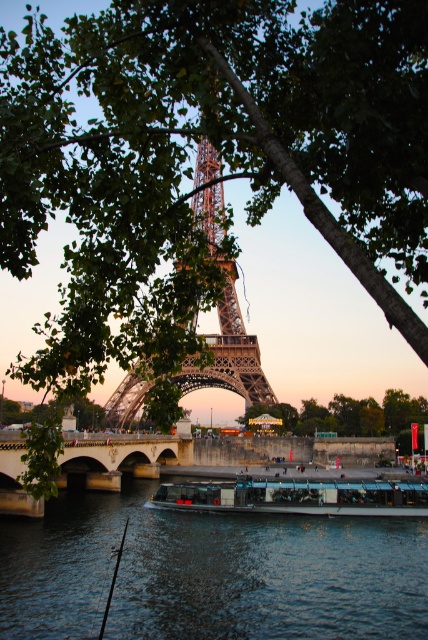
You are standing at the point where the Eiffel Tower is visible in the background. There is a dark blue water at center at point (208, 573). If you walk straight ahead from your current position, will you reach the dark blue water at center before the Eiffel Tower?

The dark blue water at center is located at point (208, 573), which is in the foreground of the scene. Since the Eiffel Tower is in the background, walking straight ahead would reach the dark blue water at center before the Eiffel Tower.

You are standing on the bridge overlooking the Seine River and see the dark blue water at center and the metallic glass boat at center. Which object is positioned to the left of the other?

The dark blue water at center is to the left of the metallic glass boat at center.